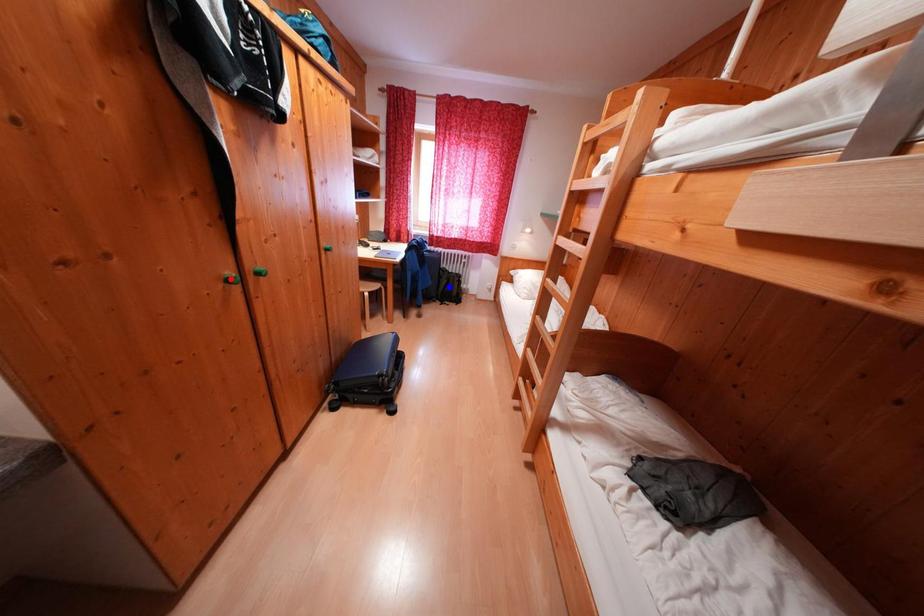
Question: Two points are marked on the image. Which point is closer to the camera?

Choices:
 (A) Blue point is closer.
 (B) Red point is closer.

Answer: (B)